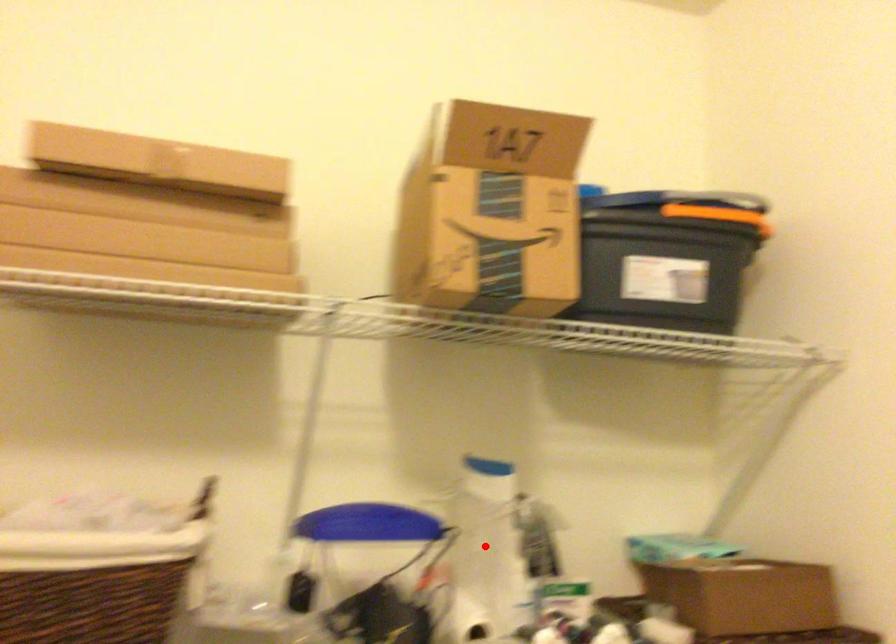
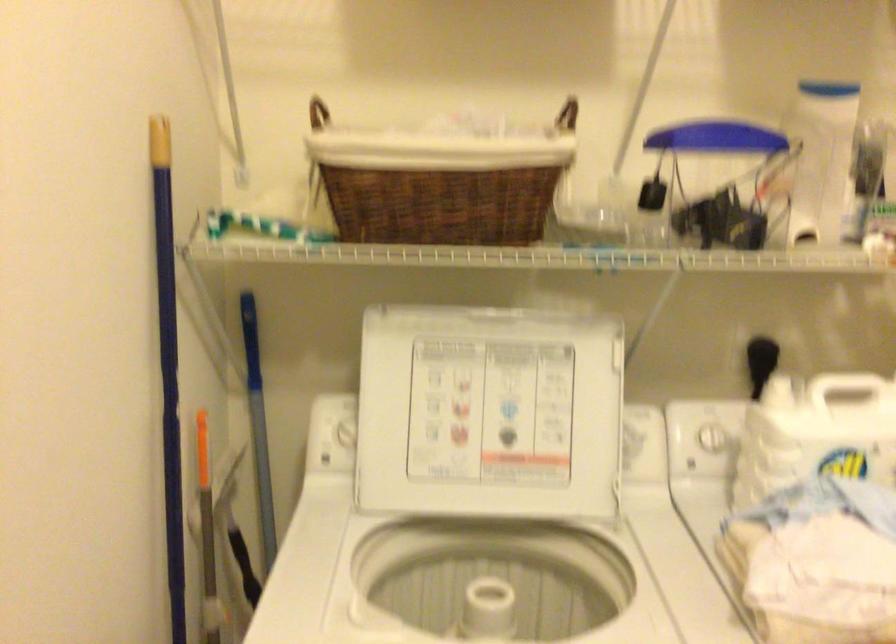
Where in the second image is the point corresponding to the highlighted location from the first image?

(821, 158)